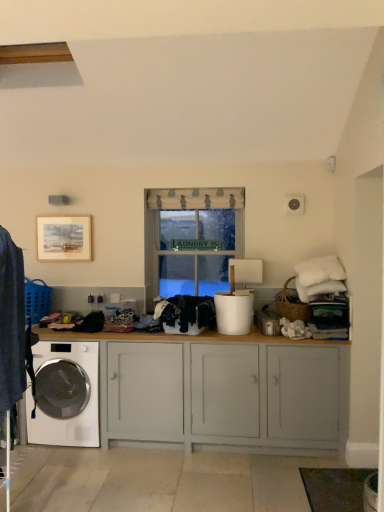
Question: From the image's perspective, is white glossy washing machine at lower left positioned above or below black cotton clothes at center, which is the first clothing from back to front?

Choices:
 (A) below
 (B) above

Answer: (A)

Question: Is white glossy washing machine at lower left taller or shorter than black cotton clothes at center, the 2th clothing from the front?

Choices:
 (A) tall
 (B) short

Answer: (A)

Question: Based on their relative distances, which object is farther from the matte paper picture frame at upper left?

Choices:
 (A) black cotton clothes at center, which is the first clothing from back to front
 (B) white fabric at center
 (C) white glossy washing machine at lower left
 (D) white painted wood cabinet at center
 (E) denim jacket at left, the 2th clothing in the back-to-front sequence

Answer: (E)

Question: Considering the real-world distances, which object is farthest from the white glossy washing machine at lower left?

Choices:
 (A) matte paper picture frame at upper left
 (B) white painted wood cabinet at center
 (C) white fabric at center
 (D) denim jacket at left, marked as the 1th clothing in a left-to-right arrangement
 (E) black cotton clothes at center, which appears as the first clothing when viewed from the right

Answer: (C)